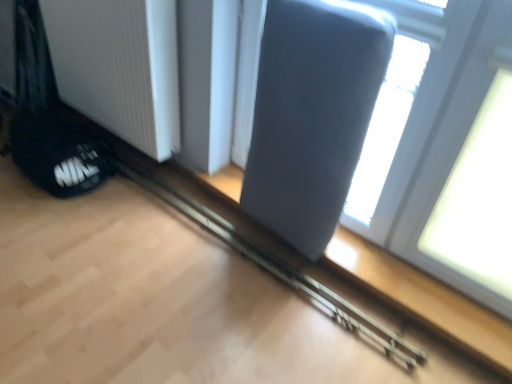
The image size is (512, 384). Identify the location of free point below white ribbed radiator at lower left (from a real-world perspective). (119, 146).